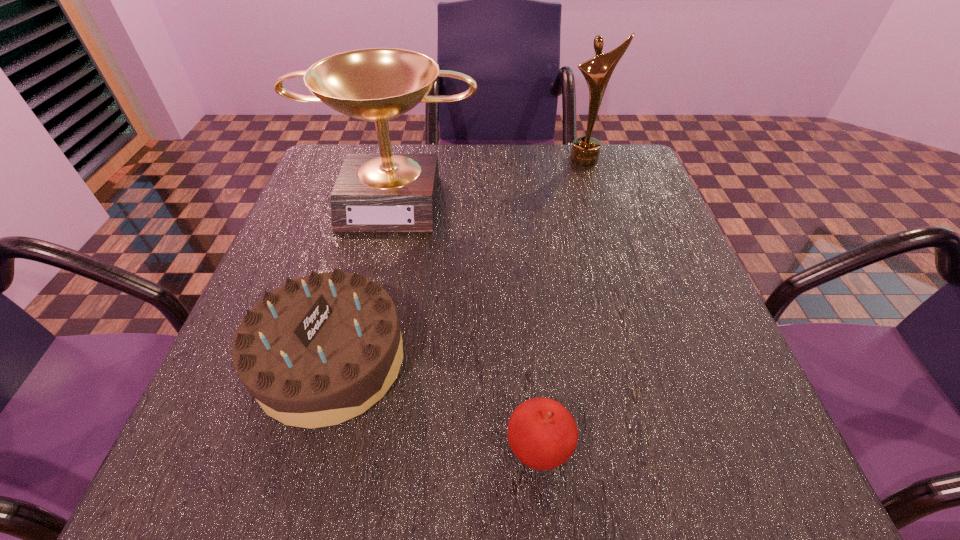
At what (x,y) coordinates should I click in order to perform the action: click on the rightmost object. Please return your answer as a coordinate pair (x, y). This screenshot has width=960, height=540. Looking at the image, I should click on (597, 71).

At what (x,y) coordinates should I click in order to perform the action: click on the left award. Please return your answer as a coordinate pair (x, y). The image size is (960, 540). Looking at the image, I should click on (386, 192).

You are a GUI agent. You are given a task and a screenshot of the screen. Output one action in this format:
    pyautogui.click(x=<x>, y=<y>)
    Task: Click on the birthday cake
    
    Given the screenshot: What is the action you would take?
    pyautogui.click(x=319, y=350)

Locate an element on the screen. The height and width of the screenshot is (540, 960). the second object from right to left is located at coordinates (542, 434).

Where is `apple`? Image resolution: width=960 pixels, height=540 pixels. apple is located at coordinates (542, 434).

Locate an element on the screen. vacant point located on the front-facing side of the rightmost object is located at coordinates (595, 191).

Image resolution: width=960 pixels, height=540 pixels. Find the location of `free space located on the front-facing side of the left award`. free space located on the front-facing side of the left award is located at coordinates (350, 382).

The width and height of the screenshot is (960, 540). Find the location of `vacant space located 0.170m on the front-facing side of the second shortest object`. vacant space located 0.170m on the front-facing side of the second shortest object is located at coordinates (507, 360).

Identify the location of vacant point located on the right of the apple. Image resolution: width=960 pixels, height=540 pixels. (634, 449).

Locate an element on the screen. The height and width of the screenshot is (540, 960). birthday cake located at the near edge is located at coordinates (319, 350).